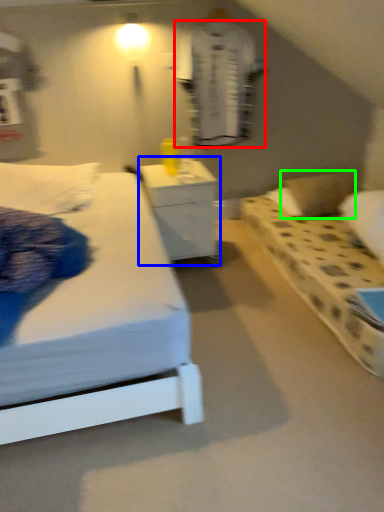
Question: Which is nearer to the robe (highlighted by a red box)? nightstand (highlighted by a blue box) or pillow (highlighted by a green box).

Choices:
 (A) nightstand
 (B) pillow

Answer: (A)